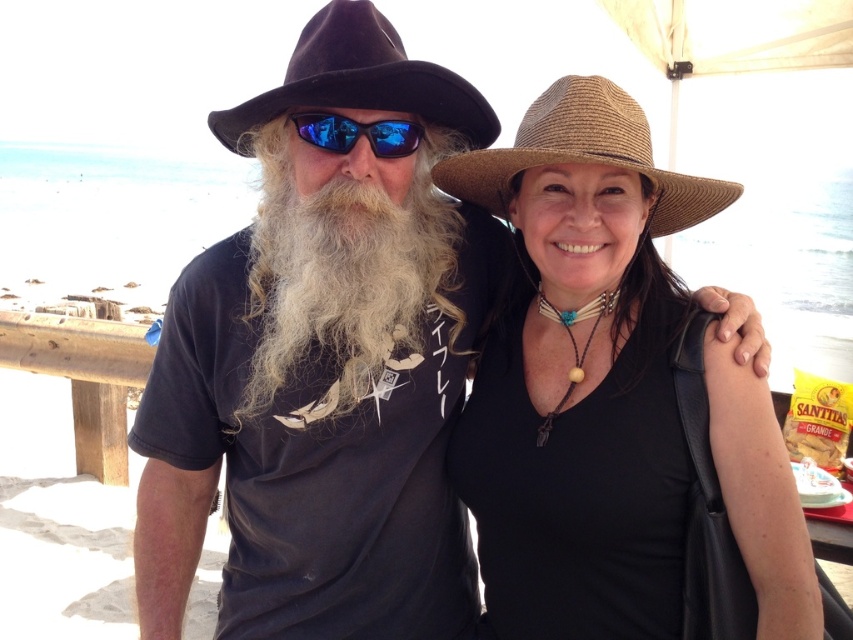
Question: Is white curly beard at center in front of braided straw hat at upper right?

Choices:
 (A) no
 (B) yes

Answer: (A)

Question: Is black felt cowboy hat at upper left smaller than blue reflective lenses at center?

Choices:
 (A) no
 (B) yes

Answer: (A)

Question: Which object is positioned farthest from the white curly beard at center?

Choices:
 (A) brown straw hat at upper center
 (B) blue reflective lenses at center
 (C) black felt cowboy hat at upper left

Answer: (A)

Question: From the image, what is the correct spatial relationship of white curly beard at center in relation to blue reflective lenses at center?

Choices:
 (A) left
 (B) right

Answer: (A)

Question: Which object is positioned closest to the brown straw hat at upper center?

Choices:
 (A) white curly beard at center
 (B) blue reflective lenses at center
 (C) braided straw hat at upper right

Answer: (C)

Question: Which point is closer to the camera?

Choices:
 (A) (292, 346)
 (B) (532, 273)
 (C) (340, 134)
 (D) (543, 152)

Answer: (D)